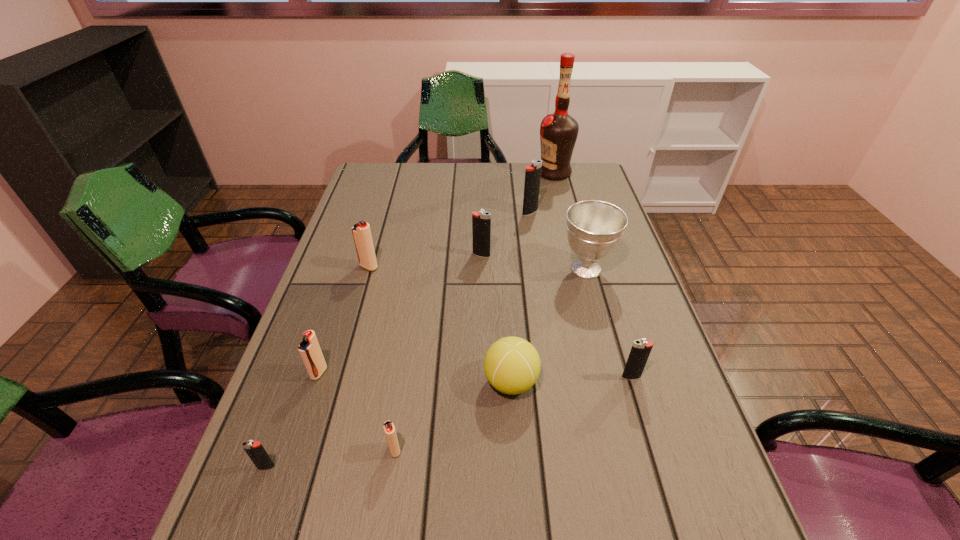
I want to click on black igniter that is the nearest to the fifth igniter from left to right, so click(532, 173).

Identify which black igniter is the second nearest to the liquor. Please provide its 2D coordinates. Your answer should be formatted as a tuple, i.e. [(x, y)], where the tuple contains the x and y coordinates of a point satisfying the conditions above.

[(481, 221)]

Locate which red igniter ranks in proximity to the tennis ball. Please provide its 2D coordinates. Your answer should be formatted as a tuple, i.e. [(x, y)], where the tuple contains the x and y coordinates of a point satisfying the conditions above.

[(389, 429)]

This screenshot has height=540, width=960. What are the coordinates of `the third closest red igniter relative to the tennis ball` in the screenshot? It's located at (361, 231).

Find the location of a particular element. vacant region that satisfies the following two spatial constraints: 1. on the front side of the second farthest black igniter; 2. on the right side of the green tennis ball is located at coordinates (482, 382).

You are a GUI agent. You are given a task and a screenshot of the screen. Output one action in this format:
    pyautogui.click(x=<x>, y=<y>)
    Task: Click on the vacant space that satisfies the following two spatial constraints: 1. on the front and back of the chalice; 2. on the right side of the tallest object
    The height and width of the screenshot is (540, 960).
    Given the screenshot: What is the action you would take?
    pyautogui.click(x=578, y=269)

The width and height of the screenshot is (960, 540). What are the coordinates of `vacant area that satisfies the following two spatial constraints: 1. on the front and back of the third biggest black igniter; 2. on the right side of the farthest object` in the screenshot? It's located at (606, 377).